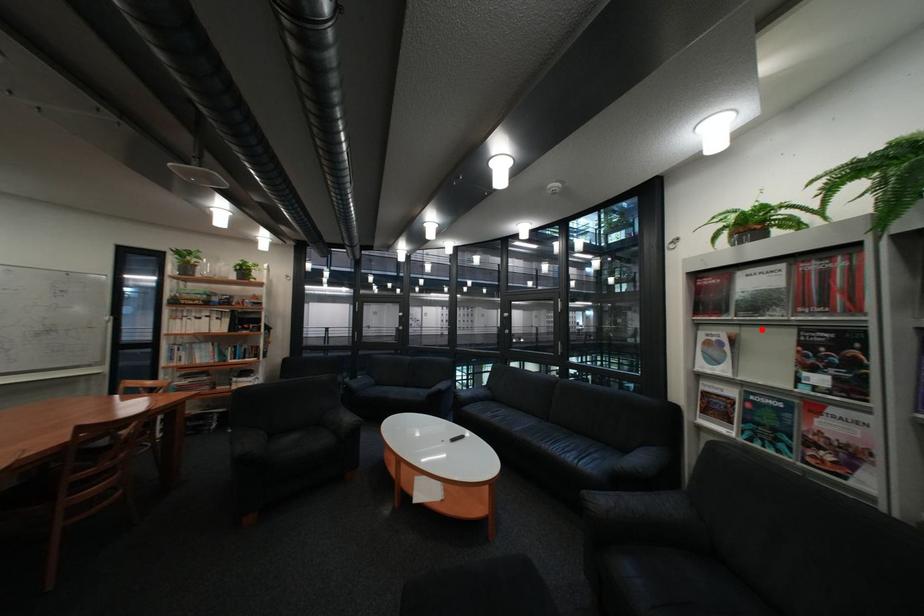
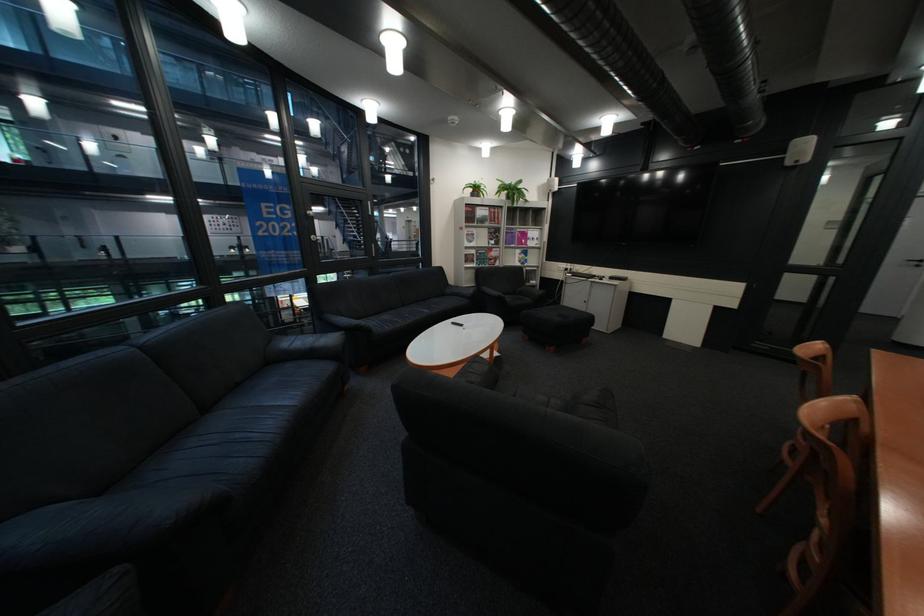
Where in the second image is the point corresponding to the highlighted location from the first image?

(492, 229)